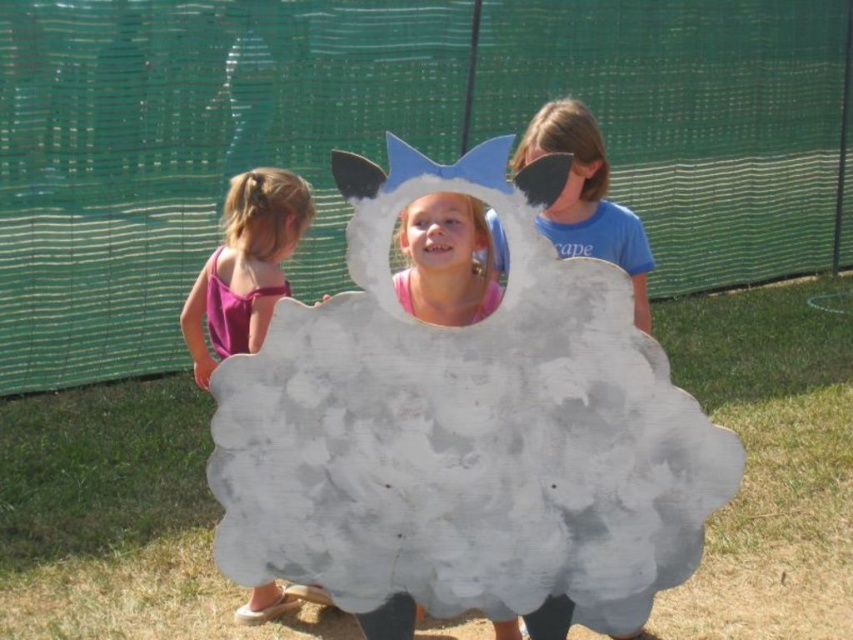
Question: Considering the real-world distances, which object is farthest from the matte pink dress at left?

Choices:
 (A) matte blue mask at center
 (B) white cotton cloud at center
 (C) smooth pink shirt at center

Answer: (B)

Question: Which point appears closest to the camera in this image?

Choices:
 (A) (552, 236)
 (B) (274, 212)

Answer: (A)

Question: Is white cotton cloud at center to the left of matte pink dress at left from the viewer's perspective?

Choices:
 (A) yes
 (B) no

Answer: (B)

Question: Is the position of matte blue mask at center less distant than that of smooth pink shirt at center?

Choices:
 (A) no
 (B) yes

Answer: (A)

Question: Can you confirm if white cotton cloud at center is wider than matte pink dress at left?

Choices:
 (A) yes
 (B) no

Answer: (A)

Question: Which of the following is the closest to the observer?

Choices:
 (A) (450, 596)
 (B) (538, 140)
 (C) (447, 211)

Answer: (A)